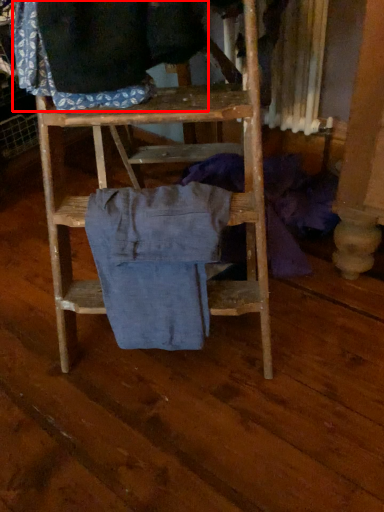
Question: From the image's perspective, where is clothing (annotated by the red box) located relative to clothing?

Choices:
 (A) below
 (B) above

Answer: (B)